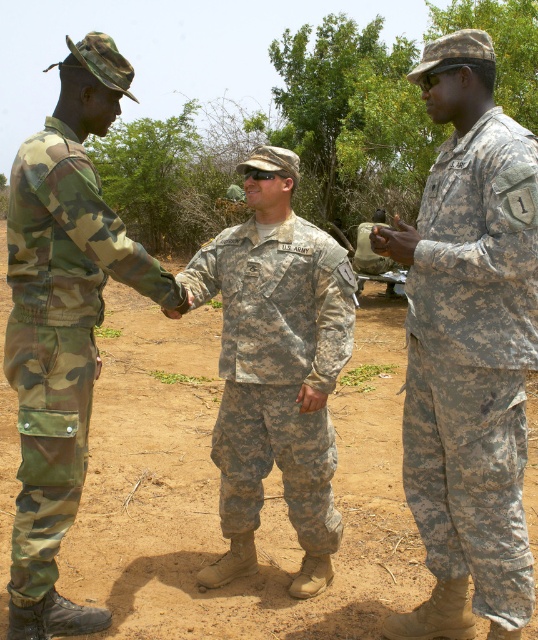
You are a photographer standing at the camera position. You want to take a closeup photo of the camouflage fabric uniform at right. The camera has a minimum focusing distance of 5 feet. Can you take the photo without moving closer?

The camouflage fabric uniform at right is 7.28 feet from camera, so yes, you can take the photo without moving closer because the distance is within the camera minimum focusing distance of 5 feet.

You are a photographer holding a camera. You want to take a photo of the camo fabric uniform at left without moving the camera. Can you do it?

The camo fabric uniform at left and camera are 2.35 meters apart, so yes, you can take a photo of the camo fabric uniform at left without moving the camera since the distance is sufficient.

You are a drone operator viewing this image from above. You need to locate the camouflage fabric uniform at right. Based on the coordinates provided in the Objects Description, can you confirm its position relative to the center of the image?

The camouflage fabric uniform at right is located at point coordinates (473, 362), which places it to the right and slightly below the center of the image since the coordinates are measured from the top left corner with 1.0 being the maximum value in each axis.